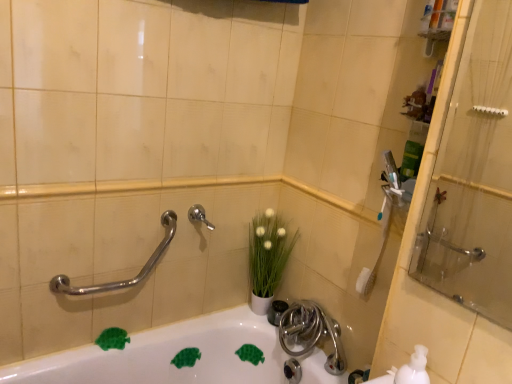
Question: Is polished chrome grab bar at upper left bigger or smaller than satin nickel faucet at center?

Choices:
 (A) big
 (B) small

Answer: (A)

Question: Is polished chrome grab bar at upper left taller or shorter than satin nickel faucet at center?

Choices:
 (A) short
 (B) tall

Answer: (B)

Question: Estimate the real-world distances between objects in this image. Which object is closer to the white glossy bathtub at lower center?

Choices:
 (A) white matte vase at center
 (B) satin nickel faucet at center
 (C) polished chrome grab bar at upper left
 (D) satin nickel faucet at lower center
 (E) white matte soap dispenser at lower right

Answer: (D)

Question: Which of these objects is positioned farthest from the transparent glass shower door at right?

Choices:
 (A) satin nickel faucet at lower center
 (B) white glossy bathtub at lower center
 (C) polished chrome grab bar at upper left
 (D) white matte vase at center
 (E) white matte soap dispenser at lower right

Answer: (C)